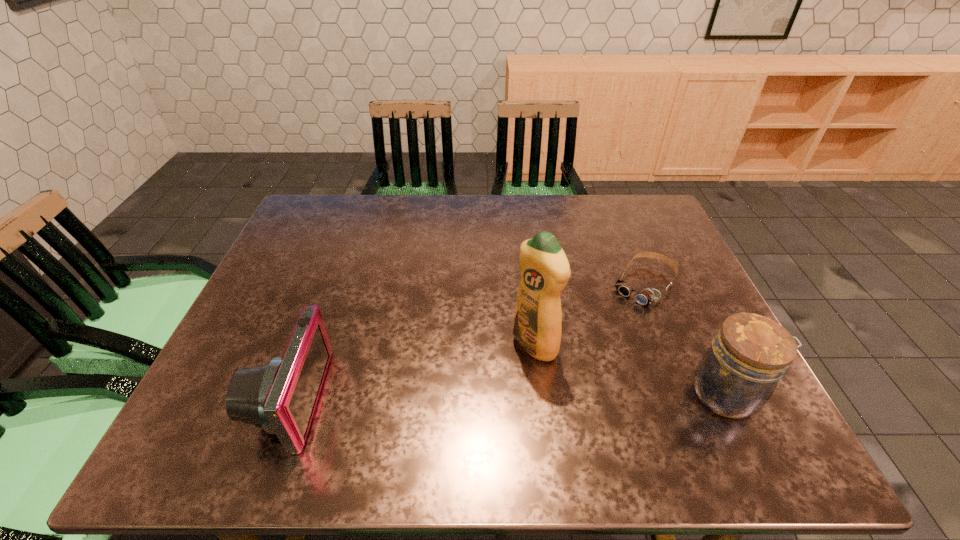
Identify the location of the third tallest object. This screenshot has height=540, width=960. pyautogui.click(x=280, y=396).

Find the location of a particular element. This screenshot has height=540, width=960. the leftmost object is located at coordinates (280, 396).

The height and width of the screenshot is (540, 960). I want to click on the second tallest object, so click(x=737, y=375).

The height and width of the screenshot is (540, 960). Find the location of `the farthest object`. the farthest object is located at coordinates (646, 296).

Locate an element on the screen. goggles is located at coordinates (646, 296).

Locate an element on the screen. Image resolution: width=960 pixels, height=540 pixels. the tallest object is located at coordinates (544, 268).

You are a GUI agent. You are given a task and a screenshot of the screen. Output one action in this format:
    pyautogui.click(x=<x>, y=<y>)
    Task: Click on the third object from right to left
    The image size is (960, 540).
    Given the screenshot: What is the action you would take?
    pyautogui.click(x=544, y=268)

Identify the location of vacant space located on the front-facing side of the leftmost object. (226, 399).

The height and width of the screenshot is (540, 960). I want to click on vacant region located on the front-facing side of the leftmost object, so click(x=211, y=399).

You are a GUI agent. You are given a task and a screenshot of the screen. Output one action in this format:
    pyautogui.click(x=<x>, y=<y>)
    Task: Click on the vacant space situated on the front-facing side of the farthest object
    Image resolution: width=960 pixels, height=540 pixels.
    Given the screenshot: What is the action you would take?
    pyautogui.click(x=598, y=341)